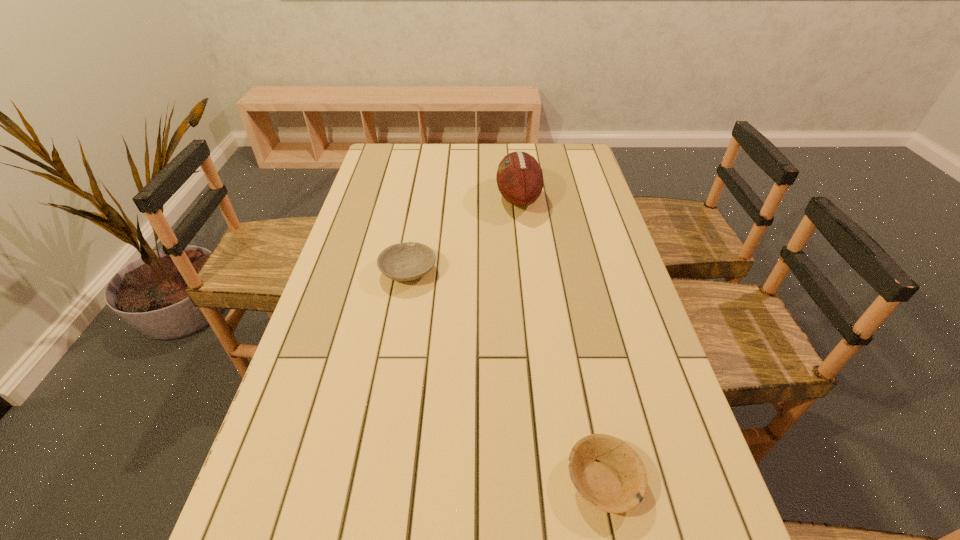
The image size is (960, 540). Find the location of `object that is positioned at the right edge`. object that is positioned at the right edge is located at coordinates [x=608, y=474].

Locate an element on the screen. This screenshot has height=540, width=960. vacant position at the far edge of the desktop is located at coordinates (417, 167).

The height and width of the screenshot is (540, 960). In the image, there is a desktop. Identify the location of free region at the left edge. (385, 229).

Find the location of a particular element. This screenshot has height=540, width=960. vacant area at the right edge of the desktop is located at coordinates (574, 179).

The image size is (960, 540). I want to click on vacant space at the far right corner of the desktop, so click(543, 148).

You are a GUI agent. You are given a task and a screenshot of the screen. Output one action in this format:
    pyautogui.click(x=<x>, y=<y>)
    Task: Click on the free spot between the tallest object and the nearest object
    
    Given the screenshot: What is the action you would take?
    pyautogui.click(x=561, y=339)

I want to click on free point between the farthest object and the nearest object, so click(561, 339).

The width and height of the screenshot is (960, 540). Identify the location of vacant space in between the right bowl and the tallest object. pos(561,339).

Locate an element on the screen. This screenshot has height=540, width=960. free space between the left bowl and the right bowl is located at coordinates (506, 376).

At what (x,y) coordinates should I click in order to perform the action: click on vacant space that is in between the nearer bowl and the second nearest object. Please return your answer as a coordinate pair (x, y). Looking at the image, I should click on (506, 376).